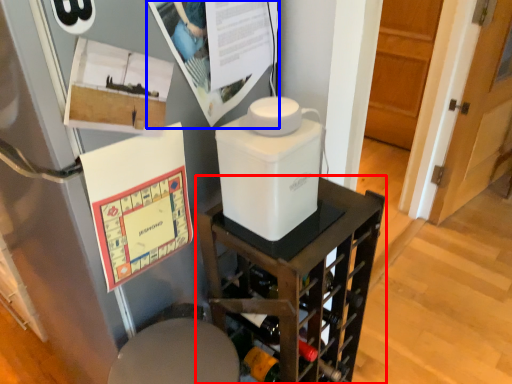
Question: Which object is further to the camera taking this photo, furniture (highlighted by a red box) or poster page (highlighted by a blue box)?

Choices:
 (A) furniture
 (B) poster page

Answer: (A)